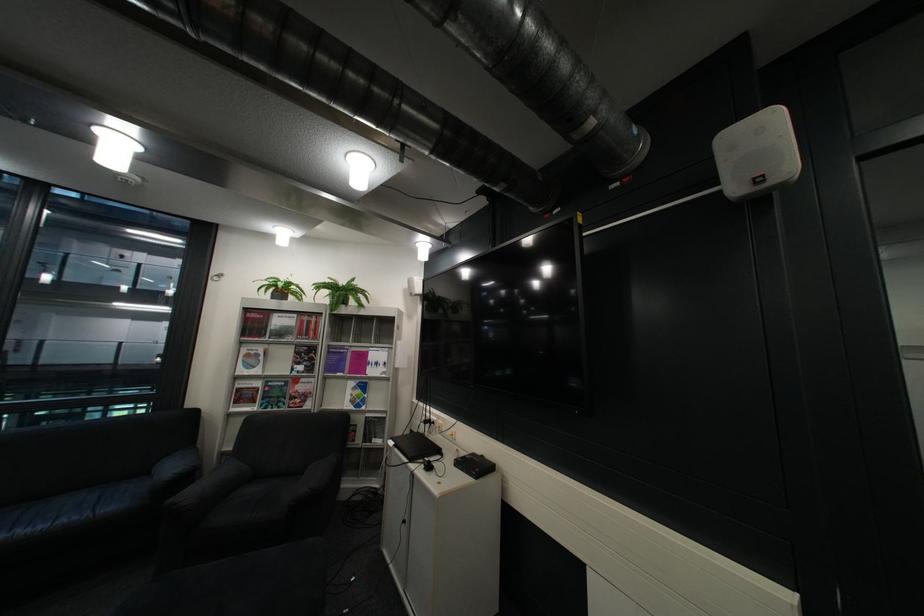
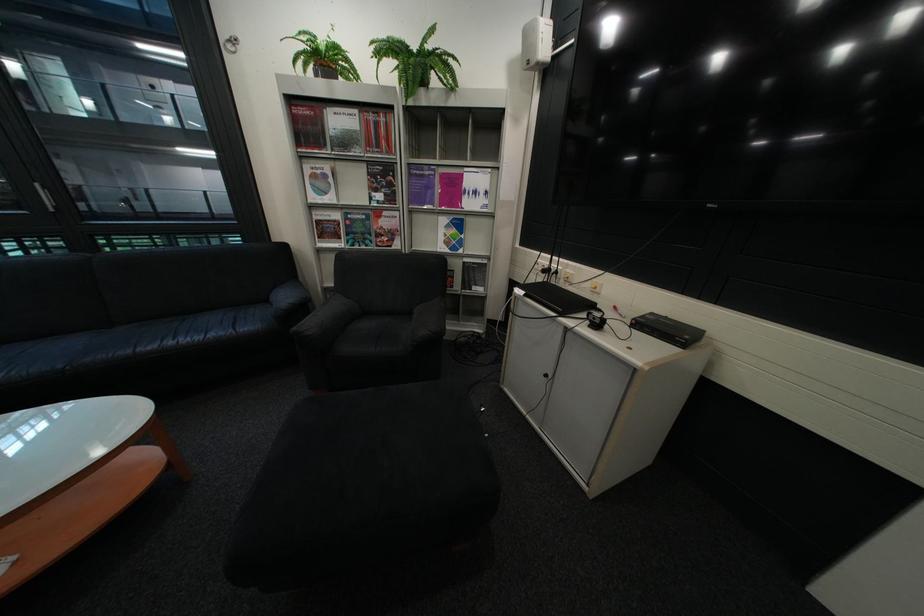
Find the pixel in the second image that matches (x=432, y=472) in the first image.

(592, 329)